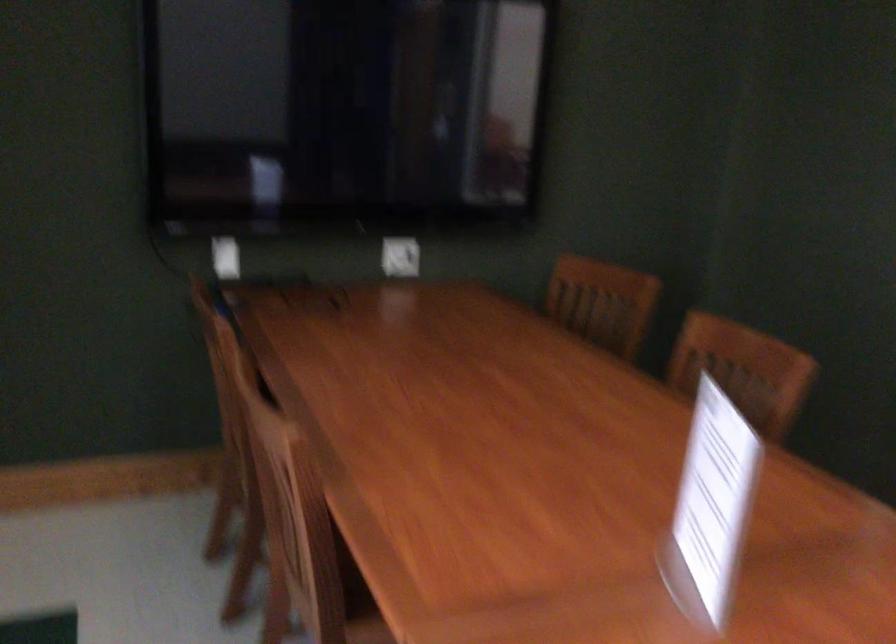
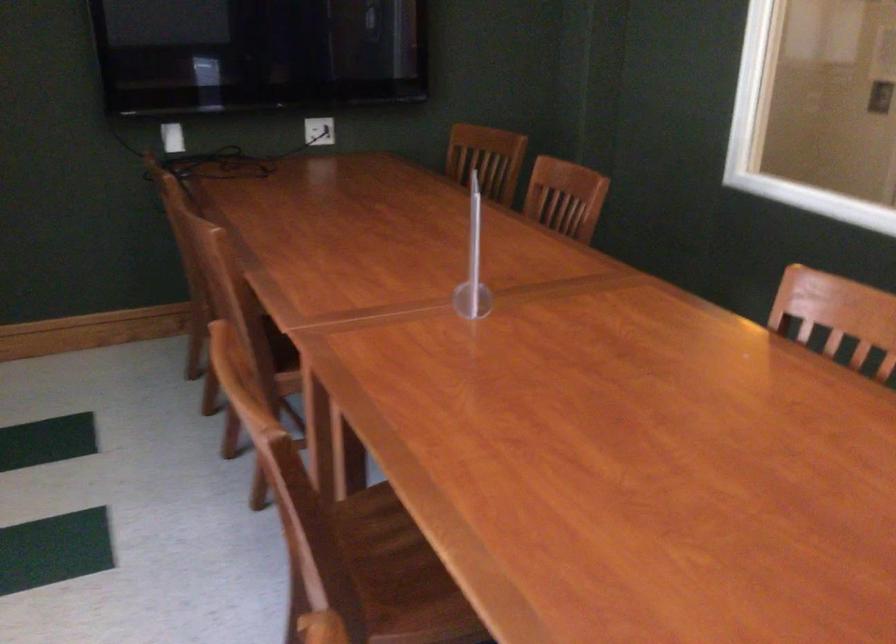
Question: How did the camera likely rotate?

Choices:
 (A) Left
 (B) Right
 (C) Up
 (D) Down

Answer: (D)